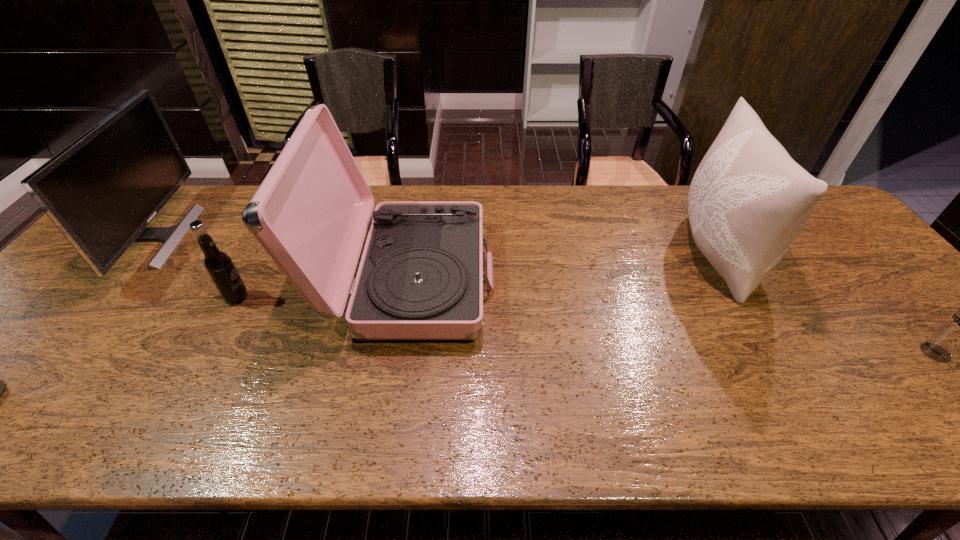
The height and width of the screenshot is (540, 960). What are the coordinates of `the third object from left to right` in the screenshot? It's located at tap(420, 277).

You are a GUI agent. You are given a task and a screenshot of the screen. Output one action in this format:
    pyautogui.click(x=<x>, y=<y>)
    Task: Click on the cushion
    Image resolution: width=960 pixels, height=540 pixels.
    Given the screenshot: What is the action you would take?
    click(x=748, y=200)

The width and height of the screenshot is (960, 540). Find the location of `monitor`. monitor is located at coordinates (101, 191).

I want to click on root beer, so click(218, 264).

At what (x,y) coordinates should I click in order to perform the action: click on vacant space located 0.370m with the lid open on the third object from left to right. Please return your answer as a coordinate pair (x, y). This screenshot has height=540, width=960. Looking at the image, I should click on (632, 278).

Find the location of `blank space located 0.200m on the front side of the cushion`. blank space located 0.200m on the front side of the cushion is located at coordinates (608, 254).

Find the location of `vacant point located on the front side of the cushion`. vacant point located on the front side of the cushion is located at coordinates tap(660, 254).

Find the location of `free space located on the front side of the cushion`. free space located on the front side of the cushion is located at coordinates (586, 254).

The image size is (960, 540). I want to click on vacant space located on the screen side of the monitor, so [242, 237].

I want to click on free space located 0.370m on the label of the second object from left to right, so click(x=394, y=297).